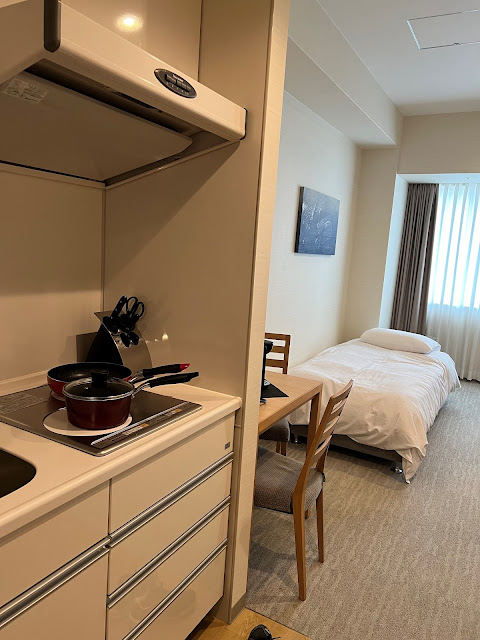
Identify the location of cooking element. The height and width of the screenshot is (640, 480). [x=34, y=404].